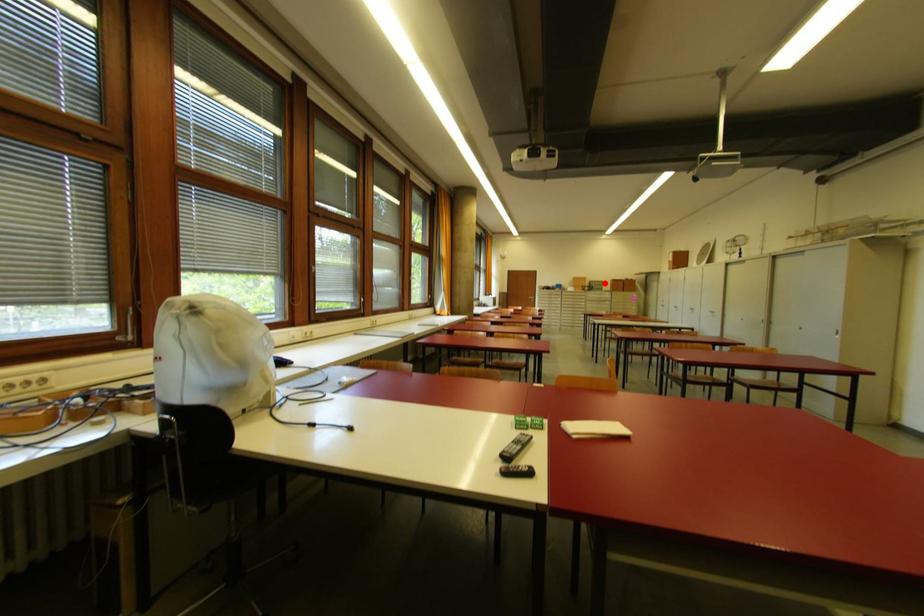
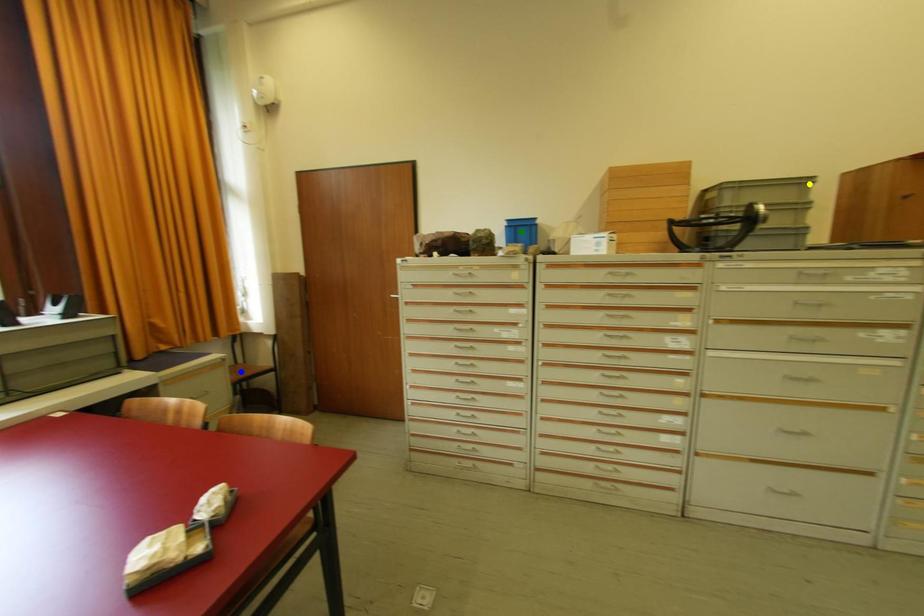
Question: I am providing you with two images of the same scene from different viewpoints. A red point is marked on the first image. You are given multiple points on the second image. Which mark in image 2 goes with the point in image 1?

Choices:
 (A) yellow point
 (B) blue point
 (C) green point

Answer: (A)